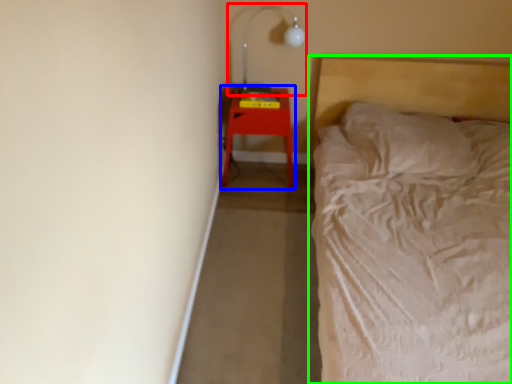
Question: Which object is the closest to the lamp (highlighted by a red box)? Choose among these: furniture (highlighted by a blue box) or bed (highlighted by a green box).

Choices:
 (A) furniture
 (B) bed

Answer: (A)